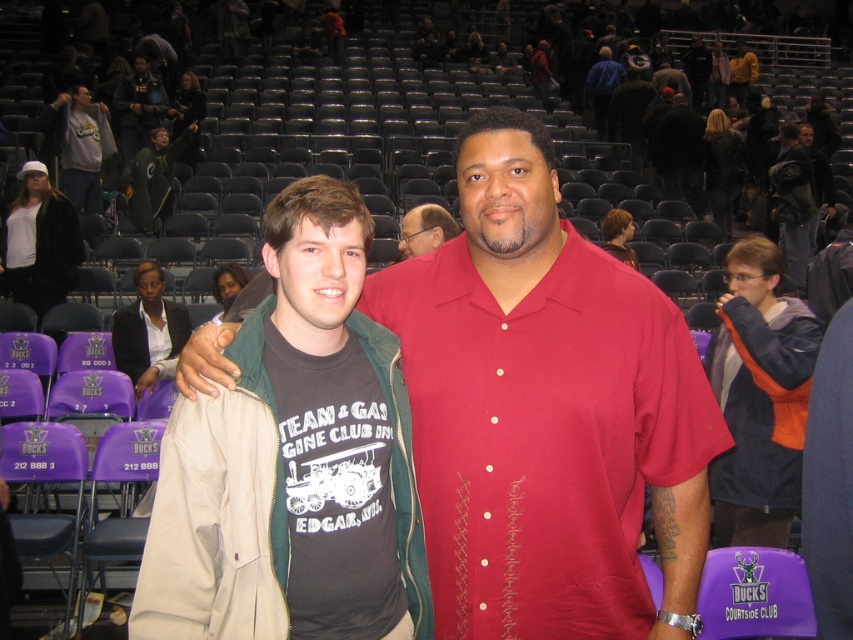
Question: Which point is closer to the camera?

Choices:
 (A) (450, 273)
 (B) (88, 173)
 (C) (148, 317)
 (D) (312, 394)

Answer: (D)

Question: Is blue fleece jacket at right further to the viewer compared to green jersey at upper left?

Choices:
 (A) no
 (B) yes

Answer: (A)

Question: Can you confirm if matte red shirt at center is wider than matte black glasses at center?

Choices:
 (A) no
 (B) yes

Answer: (B)

Question: Does green jersey at upper left have a smaller size compared to matte black glasses at center?

Choices:
 (A) no
 (B) yes

Answer: (A)

Question: Among these objects, which one is farthest from the camera?

Choices:
 (A) green jersey at upper left
 (B) dark gray jacket at upper right

Answer: (A)

Question: Among these points, which one is farthest from the camera?

Choices:
 (A) (403, 243)
 (B) (148, 209)
 (C) (144, 324)
 (D) (202, 468)

Answer: (B)